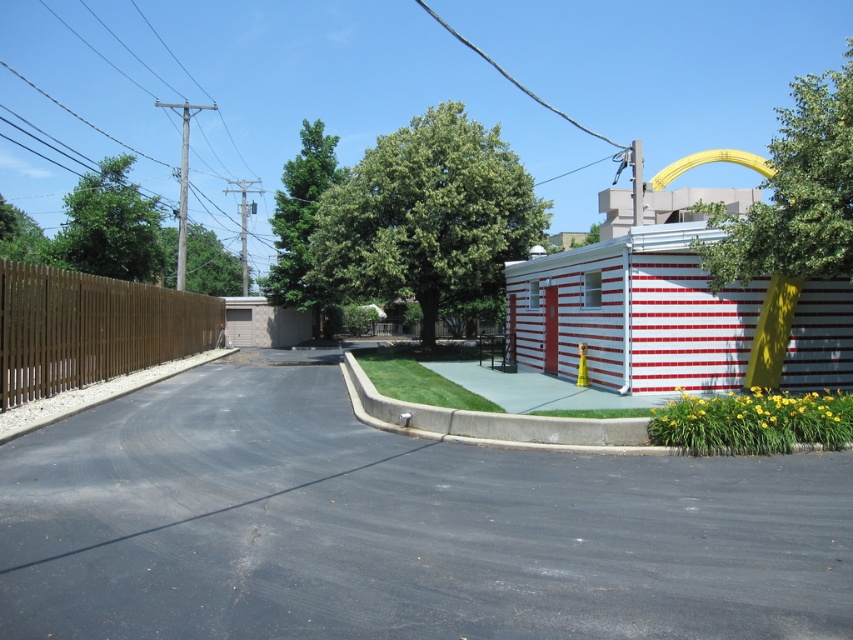
Question: Is black asphalt driveway at center closer to camera compared to brown wooden fence at left?

Choices:
 (A) no
 (B) yes

Answer: (B)

Question: Can you confirm if black asphalt driveway at center is bigger than brown wooden fence at left?

Choices:
 (A) yes
 (B) no

Answer: (B)

Question: Which point is closer to the camera taking this photo?

Choices:
 (A) (258, 296)
 (B) (595, 627)

Answer: (B)

Question: Is black asphalt driveway at center smaller than brown textured garage door at left?

Choices:
 (A) no
 (B) yes

Answer: (A)

Question: Which object is the farthest from the brown wooden fence at left?

Choices:
 (A) brown textured garage door at left
 (B) black asphalt driveway at center

Answer: (A)

Question: Which object is closer to the camera taking this photo?

Choices:
 (A) brown textured garage door at left
 (B) black asphalt driveway at center
 (C) brown wooden fence at left

Answer: (B)